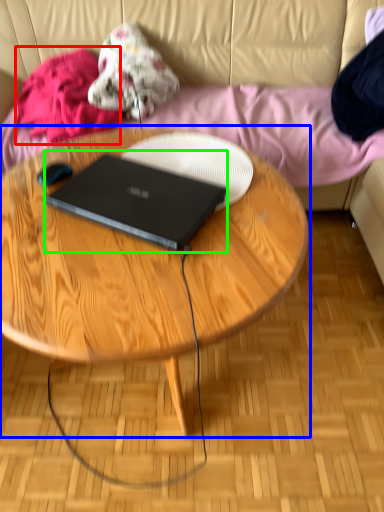
Question: Based on their relative distances, which object is farther from clothing (highlighted by a red box)? Choose from coffee table (highlighted by a blue box) and laptop (highlighted by a green box).

Choices:
 (A) coffee table
 (B) laptop

Answer: (B)